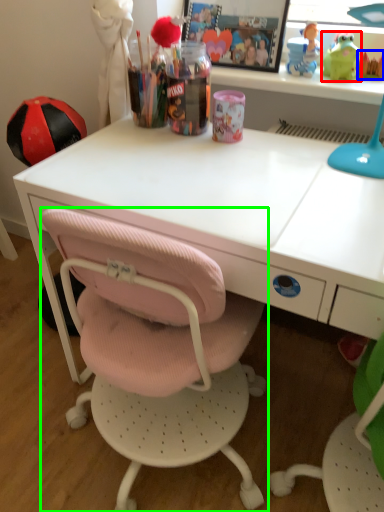
Question: Which object is the closest to the toy (highlighted by a red box)? Choose among these: toy (highlighted by a blue box) or chair (highlighted by a green box).

Choices:
 (A) toy
 (B) chair

Answer: (A)